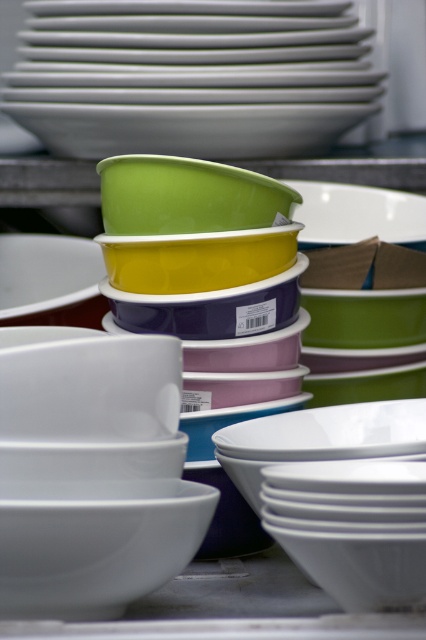
You are a warehouse worker who needs to reach a point labeled with a barcode at point (40, 508). Your arm can extend up to 25 inches. Can you reach the point without moving your position?

The distance between point (40, 508) and the camera is 27.58 inches, which is beyond your arm extension limit of 25 inches. Therefore, you cannot reach the point without moving your position.

Looking at this image, you are an inventory manager in a warehouse and need to locate two specific points marked on a map of the storage area. The first point is labeled as point (324, 401) and the second is point (210, 196). According to the image provided, which point is closer to the entrance of the storage area?

Point (210, 196) is closer to the entrance of the storage area because it is in front of point (324, 401), which is behind it.

You are organizing a display in a store and have two bowls to place on a shelf. The matte green bowl at upper center and the white glossy bowl at center. Which bowl should you choose if you need a larger one for a centerpiece?

The matte green bowl at upper center is larger than the white glossy bowl at center, so it would be the better choice for a centerpiece.